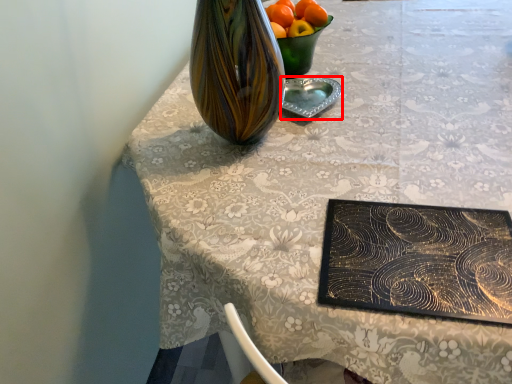
Question: From the image's perspective, what is the correct spatial relationship of tableware (annotated by the red box) in relation to orange?

Choices:
 (A) above
 (B) below

Answer: (B)